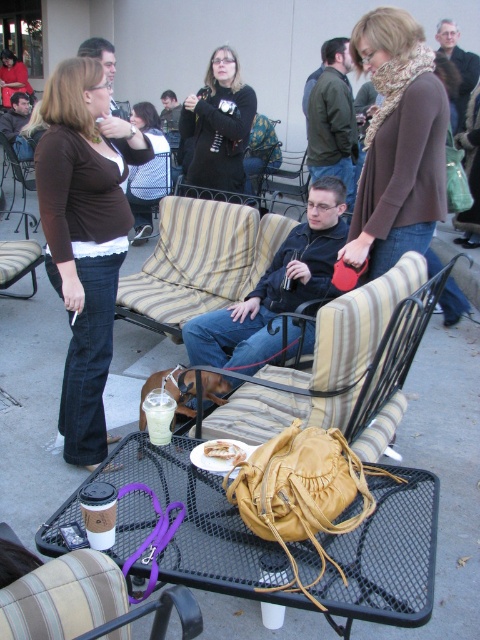
Between point (143, 205) and point (304, 196), which one is positioned in front?

Point (143, 205) is in front.

Can you confirm if matte black shirt at center is shorter than striped fabric chair at center?

Incorrect, matte black shirt at center's height does not fall short of striped fabric chair at center's.

Does point (147, 134) lie in front of point (286, 172)?

Yes.

You are a GUI agent. You are given a task and a screenshot of the screen. Output one action in this format:
    pyautogui.click(x=<x>, y=<y>)
    Task: Click on the matte black shirt at center
    The image size is (480, 640).
    Given the screenshot: What is the action you would take?
    pyautogui.click(x=147, y=172)

Describe the element at coordinates (275, 289) in the screenshot. I see `matte black jacket at center` at that location.

Who is more forward, [295,236] or [262,212]?

Point [295,236]

You are a GUI agent. You are given a task and a screenshot of the screen. Output one action in this format:
    pyautogui.click(x=<x>, y=<y>)
    Task: Click on the matte black jacket at center
    
    Given the screenshot: What is the action you would take?
    pyautogui.click(x=275, y=289)

Does leather bag at center appear over knit scarf at center?

Incorrect, leather bag at center is not positioned above knit scarf at center.

Image resolution: width=480 pixels, height=640 pixels. Describe the element at coordinates (385, 556) in the screenshot. I see `leather bag at center` at that location.

The width and height of the screenshot is (480, 640). What do you see at coordinates (385, 556) in the screenshot?
I see `leather bag at center` at bounding box center [385, 556].

I want to click on leather bag at center, so click(385, 556).